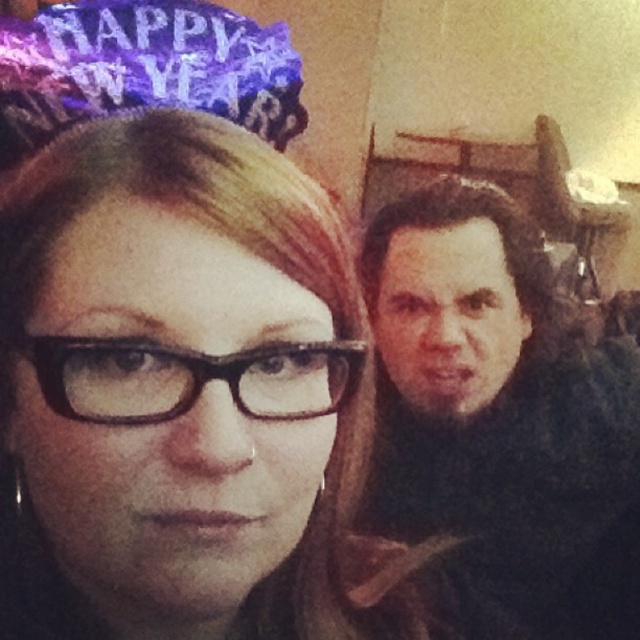
Question: Which object is farther from the camera taking this photo?

Choices:
 (A) matte black glasses at center
 (B) black plastic glasses at center

Answer: (B)

Question: Does matte black glasses at center have a larger size compared to black plastic glasses at center?

Choices:
 (A) yes
 (B) no

Answer: (A)

Question: Which of the following is the farthest from the observer?

Choices:
 (A) dark brown fur at right
 (B) matte black glasses at center

Answer: (A)

Question: Is matte black glasses at center bigger than black plastic glasses at center?

Choices:
 (A) no
 (B) yes

Answer: (B)

Question: Which object is farther from the camera taking this photo?

Choices:
 (A) matte black glasses at center
 (B) dark brown fur at right
 (C) black plastic glasses at center

Answer: (B)

Question: From the image, what is the correct spatial relationship of matte black glasses at center in relation to black plastic glasses at center?

Choices:
 (A) below
 (B) above

Answer: (A)